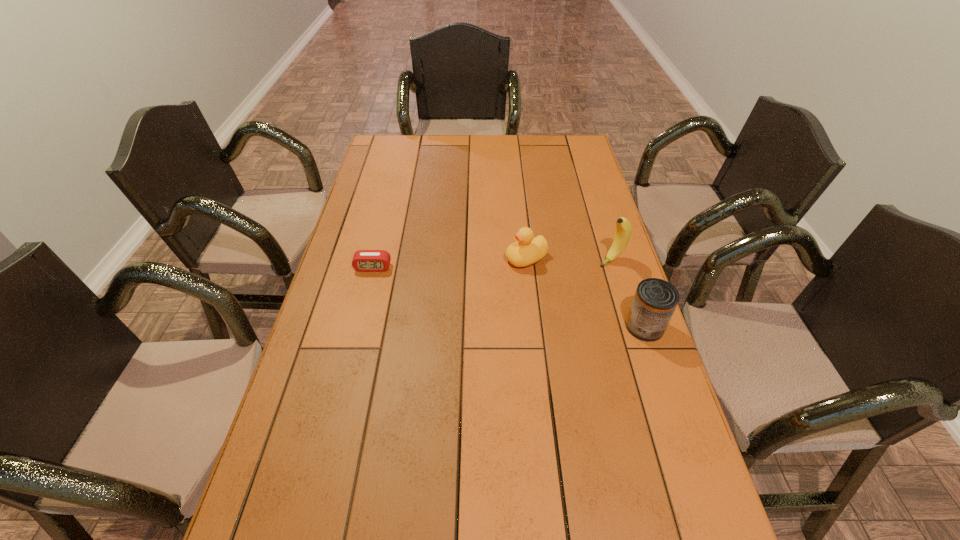
The image size is (960, 540). Find the location of `vacant space that is in between the nearest object and the second object from left to right`. vacant space that is in between the nearest object and the second object from left to right is located at coordinates click(x=586, y=293).

Locate an element on the screen. This screenshot has width=960, height=540. empty location between the nearest object and the duck is located at coordinates coord(586,293).

You are a GUI agent. You are given a task and a screenshot of the screen. Output one action in this format:
    pyautogui.click(x=<x>, y=<y>)
    Task: Click on the vacant space in between the tallest object and the shortest object
    The image size is (960, 540).
    Given the screenshot: What is the action you would take?
    pyautogui.click(x=492, y=264)

Identify which object is located as the nearest to the banana. Please provide its 2D coordinates. Your answer should be formatted as a tuple, i.e. [(x, y)], where the tuple contains the x and y coordinates of a point satisfying the conditions above.

[(526, 250)]

The height and width of the screenshot is (540, 960). In order to click on the closest object to the duck in this screenshot , I will do `click(623, 231)`.

Locate an element on the screen. The image size is (960, 540). free space that satisfies the following two spatial constraints: 1. on the front-facing side of the can; 2. on the left side of the alarm clock is located at coordinates (358, 327).

Where is `vacant space that satisfies the following two spatial constraints: 1. on the front side of the banana; 2. on the right side of the can`? The width and height of the screenshot is (960, 540). vacant space that satisfies the following two spatial constraints: 1. on the front side of the banana; 2. on the right side of the can is located at coordinates (632, 327).

Identify the location of free space that satisfies the following two spatial constraints: 1. on the front side of the third object from right to left; 2. on the right side of the can. The image size is (960, 540). (534, 327).

The image size is (960, 540). Find the location of `vacant space that satisfies the following two spatial constraints: 1. on the front-facing side of the shortest object; 2. on the right side of the can`. vacant space that satisfies the following two spatial constraints: 1. on the front-facing side of the shortest object; 2. on the right side of the can is located at coordinates (358, 327).